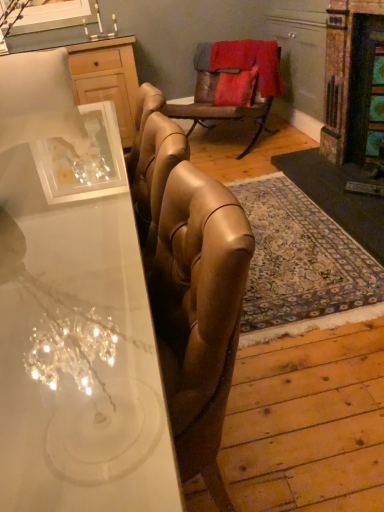
Question: Is wooden cabinet at upper left outside of white glossy desk at center?

Choices:
 (A) no
 (B) yes

Answer: (B)

Question: Is wooden cabinet at upper left aimed at white glossy desk at center?

Choices:
 (A) yes
 (B) no

Answer: (A)

Question: Is wooden cabinet at upper left at the left side of white glossy desk at center?

Choices:
 (A) yes
 (B) no

Answer: (A)

Question: From the image's perspective, is wooden cabinet at upper left above white glossy desk at center?

Choices:
 (A) yes
 (B) no

Answer: (A)

Question: Can you confirm if wooden cabinet at upper left is bigger than white glossy desk at center?

Choices:
 (A) yes
 (B) no

Answer: (B)

Question: Is wooden cabinet at upper left positioned behind white glossy desk at center?

Choices:
 (A) yes
 (B) no

Answer: (A)

Question: Considering the relative sizes of wooden cabinet at upper left and leather armchair at center in the image provided, is wooden cabinet at upper left taller than leather armchair at center?

Choices:
 (A) no
 (B) yes

Answer: (B)

Question: Does wooden cabinet at upper left have a larger size compared to leather armchair at center?

Choices:
 (A) yes
 (B) no

Answer: (A)

Question: Is wooden cabinet at upper left wider than leather armchair at center?

Choices:
 (A) yes
 (B) no

Answer: (B)

Question: From a real-world perspective, is wooden cabinet at upper left on leather armchair at center?

Choices:
 (A) no
 (B) yes

Answer: (B)

Question: Is leather armchair at center a part of wooden cabinet at upper left?

Choices:
 (A) no
 (B) yes

Answer: (A)

Question: Is wooden cabinet at upper left at the right side of leather armchair at center?

Choices:
 (A) yes
 (B) no

Answer: (B)

Question: Can you confirm if white glossy desk at center is positioned to the left of wooden cabinet at upper left?

Choices:
 (A) yes
 (B) no

Answer: (B)